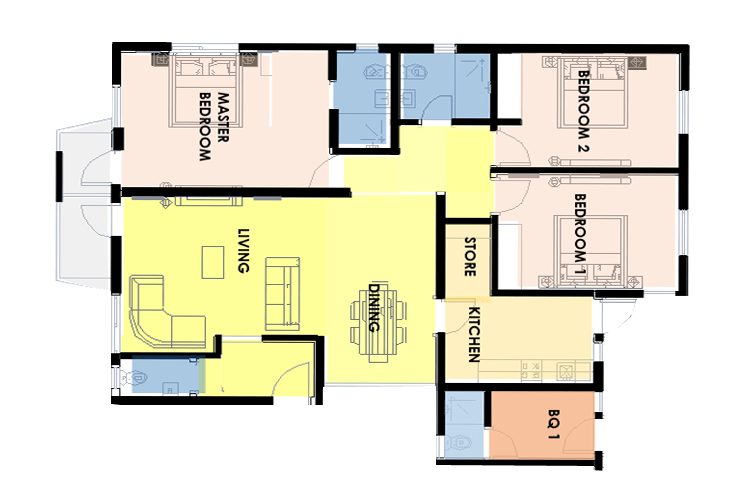
Where is `dining room`? The image size is (750, 500). dining room is located at coordinates (398, 312).